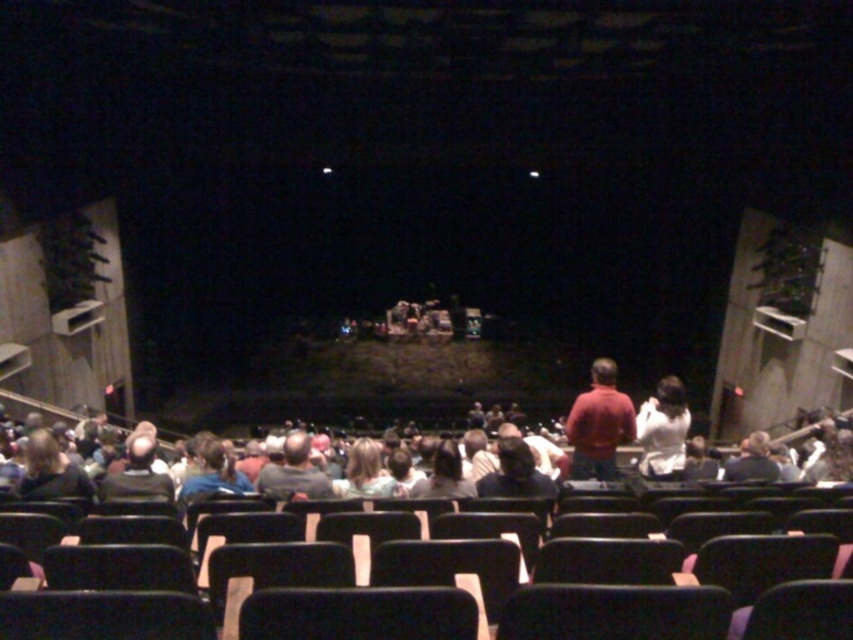
Question: Estimate the real-world distances between objects in this image. Which object is closer to the dark gray sweater at lower left?

Choices:
 (A) white fabric at center
 (B) dark gray shirt at center

Answer: (B)

Question: Estimate the real-world distances between objects in this image. Which object is closer to the dark gray sweater at lower left?

Choices:
 (A) dark gray shirt at center
 (B) matte red shirt at center

Answer: (A)

Question: Does matte red shirt at center appear on the right side of dark gray shirt at center?

Choices:
 (A) yes
 (B) no

Answer: (A)

Question: Among these objects, which one is farthest from the camera?

Choices:
 (A) matte red shirt at center
 (B) white fabric at center
 (C) dark gray sweater at lower left

Answer: (B)

Question: Does matte red shirt at center appear under dark gray shirt at center?

Choices:
 (A) no
 (B) yes

Answer: (B)

Question: Does matte red shirt at center have a lesser width compared to white fabric at center?

Choices:
 (A) yes
 (B) no

Answer: (B)